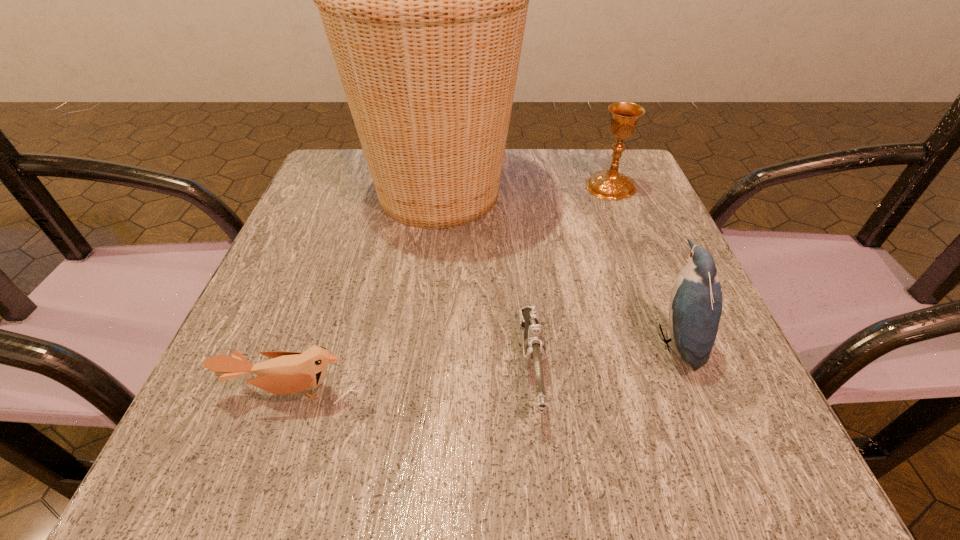
The image size is (960, 540). I want to click on free space between the gun and the taller bird, so click(603, 354).

Locate an element on the screen. This screenshot has height=540, width=960. vacant area that lies between the chalice and the shorter bird is located at coordinates (x=451, y=289).

You are a GUI agent. You are given a task and a screenshot of the screen. Output one action in this format:
    pyautogui.click(x=<x>, y=<y>)
    Task: Click on the free space between the shortest object and the right bird
    Image resolution: width=960 pixels, height=540 pixels.
    Given the screenshot: What is the action you would take?
    pyautogui.click(x=603, y=354)

This screenshot has height=540, width=960. Identify the location of free area in between the chalice and the right bird. (642, 264).

Where is `vacant space that's between the tallest object and the right bird`? This screenshot has width=960, height=540. vacant space that's between the tallest object and the right bird is located at coordinates (556, 267).

Identify which object is the third closest to the right bird. Please provide its 2D coordinates. Your answer should be formatted as a tuple, i.e. [(x, y)], where the tuple contains the x and y coordinates of a point satisfying the conditions above.

[(610, 184)]

Locate an element on the screen. The height and width of the screenshot is (540, 960). object that stands as the second closest to the left bird is located at coordinates (423, 0).

Find the location of `free point that satisfies the following two spatial constraints: 1. at the tip of the taller bird's beak; 2. aimed along the barrel of the shortest object`. free point that satisfies the following two spatial constraints: 1. at the tip of the taller bird's beak; 2. aimed along the barrel of the shortest object is located at coordinates (684, 367).

In order to click on free space that satisfies the following two spatial constraints: 1. at the tip of the right bird's beak; 2. at the beak of the shorter bird in this screenshot , I will do `click(694, 393)`.

Where is `free location that satisfies the following two spatial constraints: 1. at the tip of the taller bird's beak; 2. aimed along the barrel of the shortest object`? This screenshot has width=960, height=540. free location that satisfies the following two spatial constraints: 1. at the tip of the taller bird's beak; 2. aimed along the barrel of the shortest object is located at coordinates (684, 367).